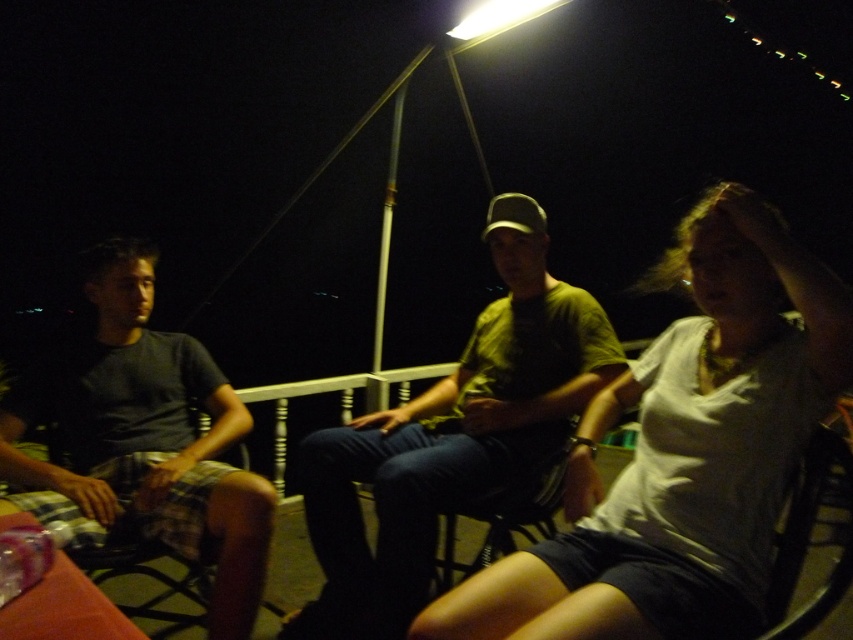
Question: Which object appears farthest from the camera in this image?

Choices:
 (A) dark gray t-shirt at left
 (B) white cotton shirt at center

Answer: (A)

Question: Is white cotton shirt at center bigger than dark gray t-shirt at left?

Choices:
 (A) yes
 (B) no

Answer: (B)

Question: Is green matte shirt at center bigger than dark gray t-shirt at left?

Choices:
 (A) no
 (B) yes

Answer: (B)

Question: Does white cotton shirt at center have a smaller size compared to dark gray t-shirt at left?

Choices:
 (A) no
 (B) yes

Answer: (B)

Question: Which point is farther from the camera taking this photo?

Choices:
 (A) click(x=349, y=436)
 (B) click(x=252, y=497)
 (C) click(x=674, y=337)

Answer: (A)

Question: Which point appears farthest from the camera in this image?

Choices:
 (A) (631, 365)
 (B) (518, 257)

Answer: (B)